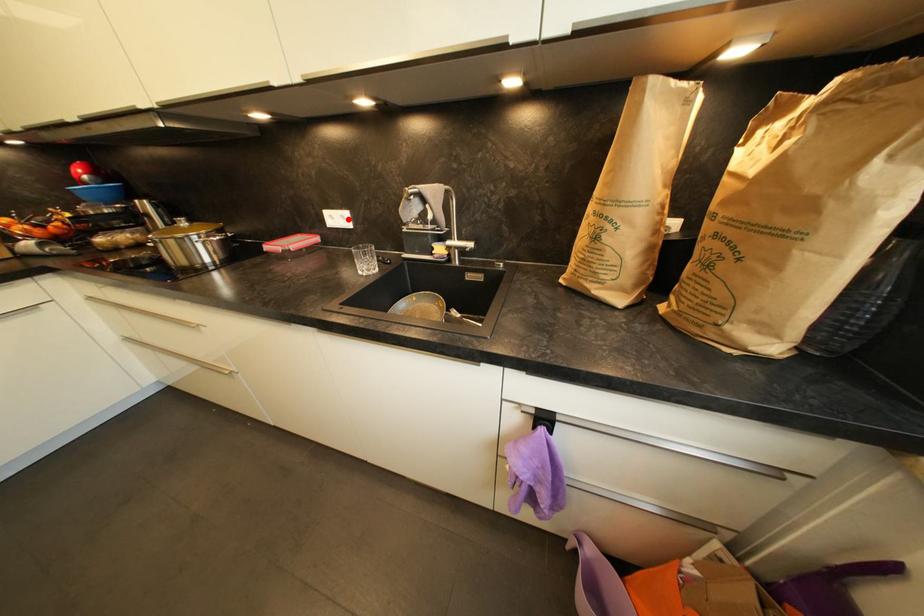
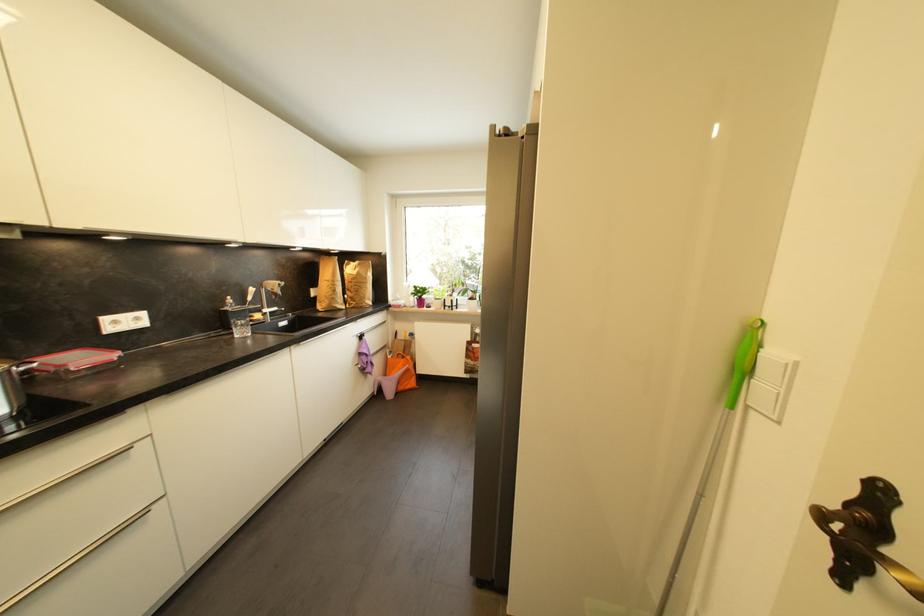
Where in the second image is the point corresponding to the highlighted location from the first image?

(142, 321)